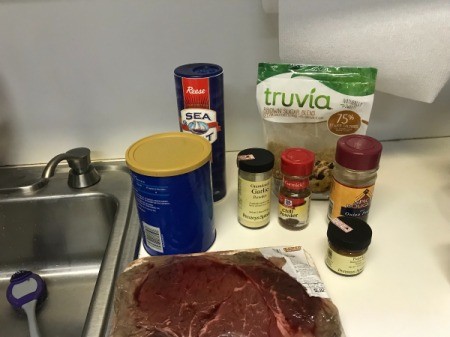
Image resolution: width=450 pixels, height=337 pixels. What are the coordinates of `paper towel` in the screenshot? It's located at (416, 62).